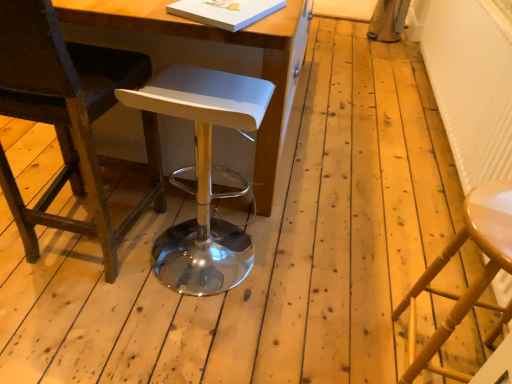
Question: From a real-world perspective, relative to wooden table at center, is white plastic stool at center, acting as the second stool starting from the right, vertically above or below?

Choices:
 (A) below
 (B) above

Answer: (A)

Question: Is white plastic stool at center, acting as the second stool starting from the right, inside the boundaries of wooden table at center, or outside?

Choices:
 (A) outside
 (B) inside

Answer: (B)

Question: Estimate the real-world distances between objects in this image. Which object is farther from the white plastic stool at center, acting as the second stool starting from the right?

Choices:
 (A) dark brown leather chair at left
 (B) white textured radiator at right
 (C) wooden chair at right, the first stool when ordered from right to left
 (D) wooden table at center

Answer: (B)

Question: Considering the real-world distances, which object is farthest from the wooden table at center?

Choices:
 (A) dark brown leather chair at left
 (B) white textured radiator at right
 (C) wooden chair at right, positioned as the second stool in left-to-right order
 (D) white plastic stool at center, acting as the second stool starting from the right

Answer: (B)